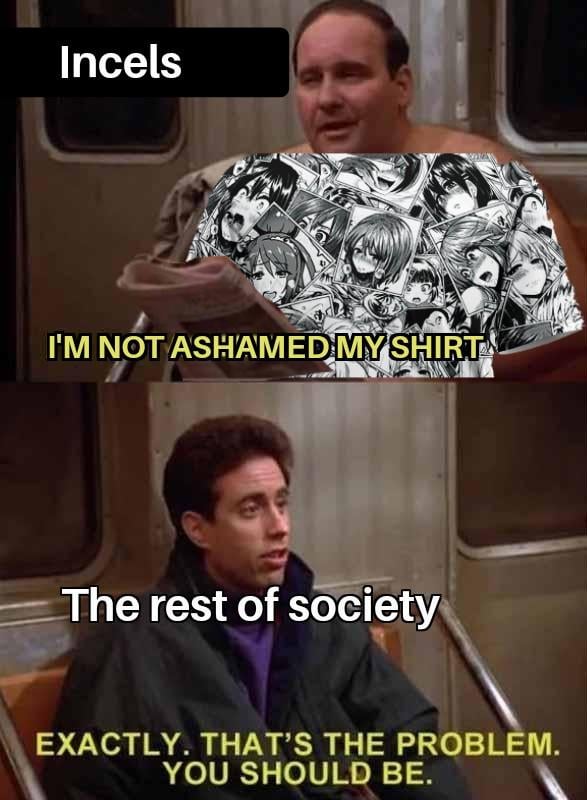
This screenshot has width=587, height=800. What are the coordinates of `wall` in the screenshot? It's located at (404, 481), (437, 38).